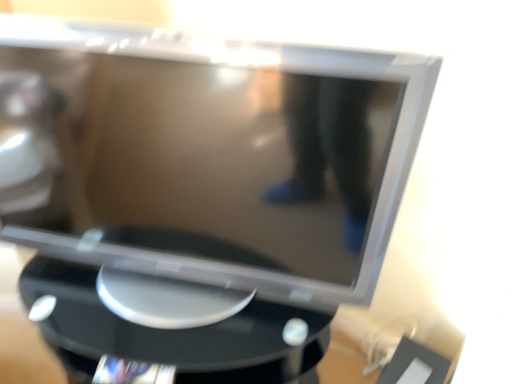
Where is `vacant space underneath satin black monitor at center (from a real-world perspective)`? vacant space underneath satin black monitor at center (from a real-world perspective) is located at coordinates (166, 296).